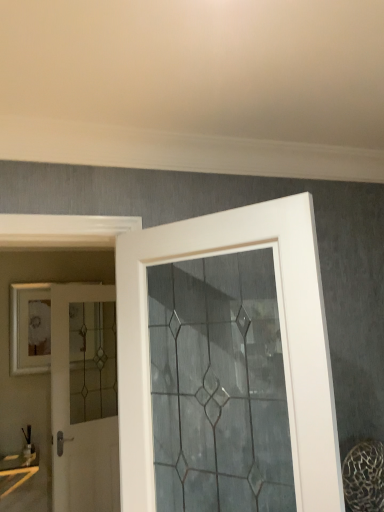
I want to click on white glass door at left, the second door when ordered from right to left, so click(79, 424).

What do you see at coordinates (79, 424) in the screenshot? I see `white glass door at left, the first door in the back-to-front sequence` at bounding box center [79, 424].

The height and width of the screenshot is (512, 384). I want to click on white glass door at center, which appears as the second door when viewed from the left, so click(281, 340).

Measure the distance between point (x=200, y=226) and camera.

Point (x=200, y=226) is 4.58 feet away from camera.

What do you see at coordinates (281, 340) in the screenshot? I see `white glass door at center, arranged as the second door when viewed from the back` at bounding box center [281, 340].

In order to click on white glass door at left, positioned as the second door in front-to-back order in this screenshot , I will do `click(79, 424)`.

In the scene shown: Between white glass door at left, acting as the first door starting from the left, and white glass door at center, which is the first door from right to left, which one appears on the left side from the viewer's perspective?

From the viewer's perspective, white glass door at left, acting as the first door starting from the left, appears more on the left side.

Is the depth of white glass door at left, the first door in the back-to-front sequence, greater than that of white glass door at center, arranged as the second door when viewed from the back?

Yes, white glass door at left, the first door in the back-to-front sequence, is further from the camera.

Which is farther, (x=64, y=422) or (x=294, y=355)?

Point (x=64, y=422)

From the picture: From the image's perspective, is white glass door at left, the first door in the back-to-front sequence, above or below white glass door at center, the first door from the front?

white glass door at left, the first door in the back-to-front sequence, is below white glass door at center, the first door from the front.

From a real-world perspective, which is physically above, white glass door at left, acting as the first door starting from the left, or white glass door at center, which appears as the second door when viewed from the left?

white glass door at center, which appears as the second door when viewed from the left, from a real-world perspective.

From the picture: Looking at their sizes, would you say white glass door at left, the first door in the back-to-front sequence, is wider or thinner than white glass door at center, which is the first door from right to left?

white glass door at left, the first door in the back-to-front sequence, is thinner than white glass door at center, which is the first door from right to left.

Who is taller, white glass door at left, acting as the first door starting from the left, or white glass door at center, which appears as the second door when viewed from the left?

Standing taller between the two is white glass door at left, acting as the first door starting from the left.

Between white glass door at left, acting as the first door starting from the left, and white glass door at center, the first door from the front, which one has smaller size?

Smaller between the two is white glass door at left, acting as the first door starting from the left.

Is white glass door at left, positioned as the second door in front-to-back order, positioned beyond the bounds of white glass door at center, which appears as the second door when viewed from the left?

Absolutely, white glass door at left, positioned as the second door in front-to-back order, is external to white glass door at center, which appears as the second door when viewed from the left.

Would you consider white glass door at left, acting as the first door starting from the left, to be distant from white glass door at center, which is the first door from right to left?

Yes, white glass door at left, acting as the first door starting from the left, and white glass door at center, which is the first door from right to left, are located far from each other.

In the scene shown: Is white glass door at left, the first door in the back-to-front sequence, facing towards white glass door at center, which appears as the second door when viewed from the left?

Yes, white glass door at left, the first door in the back-to-front sequence, is facing white glass door at center, which appears as the second door when viewed from the left.

Locate an element on the screen. This screenshot has height=512, width=384. door in front of the white glass door at left, positioned as the second door in front-to-back order is located at coordinates (281, 340).

Which is more to the left, white glass door at center, which appears as the second door when viewed from the left, or white glass door at left, positioned as the second door in front-to-back order?

white glass door at left, positioned as the second door in front-to-back order.

Is the position of white glass door at center, which appears as the second door when viewed from the left, more distant than that of white glass door at left, positioned as the second door in front-to-back order?

No, white glass door at center, which appears as the second door when viewed from the left, is closer to the camera.

Does point (147, 249) come in front of point (108, 510)?

Yes.

Consider the image. From the image's perspective, does white glass door at center, the first door from the front, appear lower than white glass door at left, the second door when ordered from right to left?

No.

From a real-world perspective, does white glass door at center, the first door from the front, stand above white glass door at left, the second door when ordered from right to left?

Yes, from a real-world perspective, white glass door at center, the first door from the front, is on top of white glass door at left, the second door when ordered from right to left.

Considering the relative sizes of white glass door at center, which is the first door from right to left, and white glass door at left, positioned as the second door in front-to-back order, in the image provided, is white glass door at center, which is the first door from right to left, wider than white glass door at left, positioned as the second door in front-to-back order,?

Correct, the width of white glass door at center, which is the first door from right to left, exceeds that of white glass door at left, positioned as the second door in front-to-back order.

Does white glass door at center, the first door from the front, have a greater height compared to white glass door at left, the first door in the back-to-front sequence?

No.

In terms of size, does white glass door at center, arranged as the second door when viewed from the back, appear bigger or smaller than white glass door at left, positioned as the second door in front-to-back order?

Clearly, white glass door at center, arranged as the second door when viewed from the back, is larger in size than white glass door at left, positioned as the second door in front-to-back order.

From the picture: Would you say white glass door at center, which appears as the second door when viewed from the left, is outside white glass door at left, the first door in the back-to-front sequence?

white glass door at center, which appears as the second door when viewed from the left, lies outside white glass door at left, the first door in the back-to-front sequence,'s area.

Is white glass door at center, which appears as the second door when viewed from the left, far from white glass door at left, positioned as the second door in front-to-back order?

Indeed, white glass door at center, which appears as the second door when viewed from the left, is not near white glass door at left, positioned as the second door in front-to-back order.

Is white glass door at center, the first door from the front, oriented away from white glass door at left, the first door in the back-to-front sequence?

No, white glass door at center, the first door from the front,'s orientation is not away from white glass door at left, the first door in the back-to-front sequence.

How different are the orientations of white glass door at center, the first door from the front, and white glass door at left, acting as the first door starting from the left, in degrees?

white glass door at center, the first door from the front, and white glass door at left, acting as the first door starting from the left, are facing 72.4 degrees away from each other.

You are a GUI agent. You are given a task and a screenshot of the screen. Output one action in this format:
    pyautogui.click(x=<x>, y=<y>)
    Task: Click on the door that is above the white glass door at left, positioned as the second door in front-to-back order (from a real-world perspective)
    This screenshot has width=384, height=512.
    Given the screenshot: What is the action you would take?
    pyautogui.click(x=281, y=340)

Where is `door below the white glass door at center, which is the first door from right to left (from the image's perspective)`? This screenshot has height=512, width=384. door below the white glass door at center, which is the first door from right to left (from the image's perspective) is located at coordinates (79, 424).

Locate an element on the screen. The height and width of the screenshot is (512, 384). door on the right of white glass door at left, acting as the first door starting from the left is located at coordinates (281, 340).